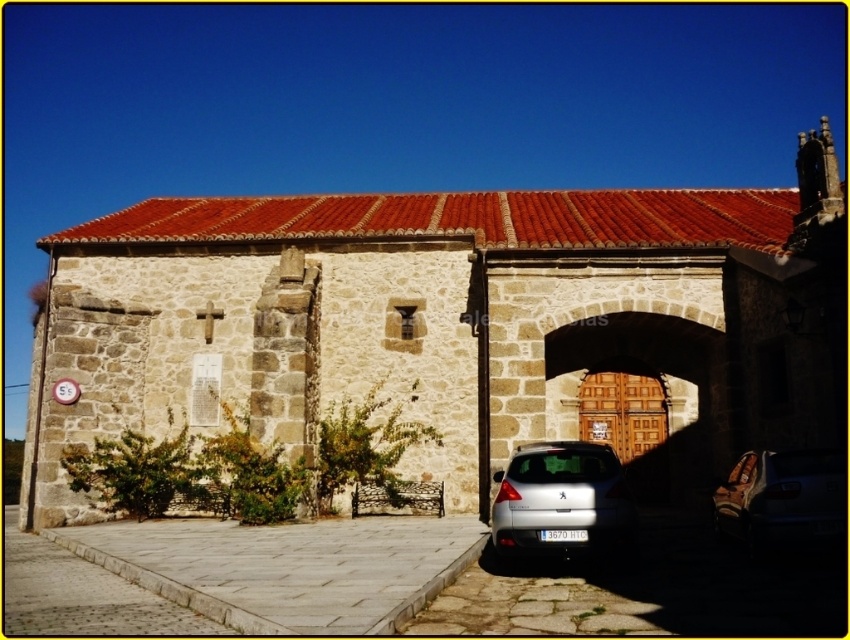
You are standing in front of the rustic stone building and see two cars, a satin silver car at lower center and a metallic silver car at center. Which car is closer to you?

The satin silver car at lower center is closer to you because it is further to the viewer than the metallic silver car at center.

You are standing in front of the rustic stone building. You notice two points marked on the wall. The first point is at coordinates point (x=518, y=552) and the second is at point (x=820, y=493). Which point is closer to you?

Point (x=820, y=493) is closer to you because it is in front of point (x=518, y=552).